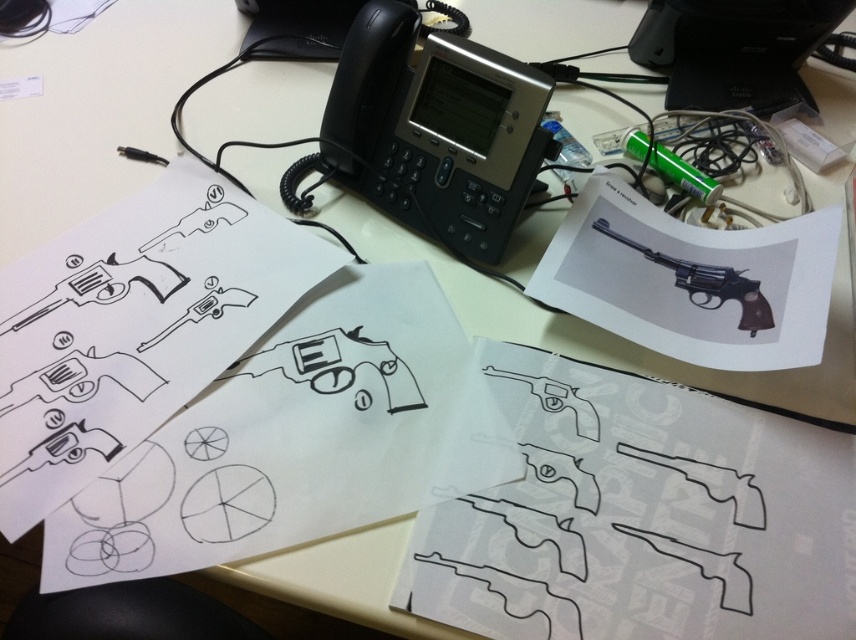
You are an office worker who needs to reach the office phone in the center of the desk. There is a matte black revolver at upper right and a black line drawing revolver at center on the desk. Which object is closer to you as you approach the desk?

The matte black revolver at upper right is closer to you because it is in front of the black line drawing revolver at center.

You are organizing the items on the desk and need to place a new item between the black paper at upper left and the black plastic phone at center. Where should you place it?

You should place the new item between the black paper at upper left and the black plastic phone at center, to the right of the black paper at upper left since it is positioned on the left side of the black plastic phone at center.